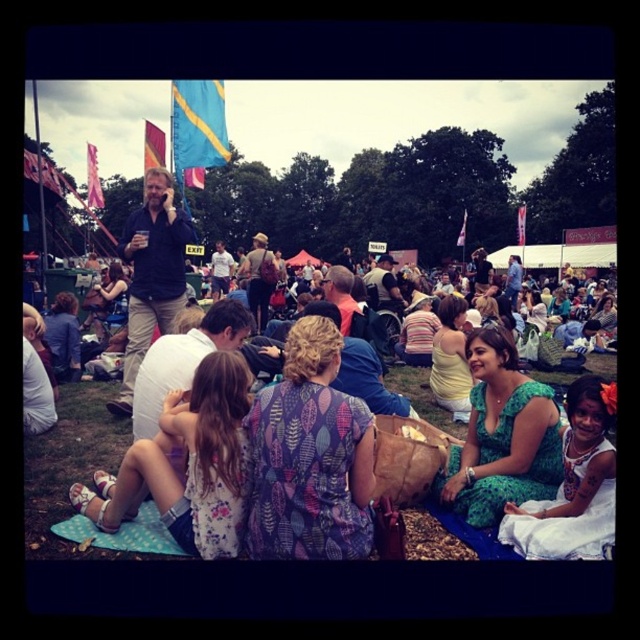
You are a GUI agent. You are given a task and a screenshot of the screen. Output one action in this format:
    pyautogui.click(x=<x>, y=<y>)
    Task: Click on the dark blue shirt at center
    
    Given the screenshot: What is the action you would take?
    pyautogui.click(x=150, y=275)

Can you confirm if dark blue shirt at center is positioned above matte brown backpack at center?

Correct, dark blue shirt at center is located above matte brown backpack at center.

Which is in front, point (134, 282) or point (333, 301)?

Positioned in front is point (134, 282).

You are a GUI agent. You are given a task and a screenshot of the screen. Output one action in this format:
    pyautogui.click(x=<x>, y=<y>)
    Task: Click on the dark blue shirt at center
    
    Given the screenshot: What is the action you would take?
    pyautogui.click(x=150, y=275)

Is printed fabric blanket at center below blue fabric flag at upper center?

Yes, printed fabric blanket at center is below blue fabric flag at upper center.

Is printed fabric blanket at center shorter than blue fabric flag at upper center?

Yes.

Where is `printed fabric blanket at center`? Image resolution: width=640 pixels, height=640 pixels. printed fabric blanket at center is located at coordinates (70, 468).

Locate an element on the screen. printed fabric blanket at center is located at coordinates (70, 468).

Is point (170, 218) farther from viewer compared to point (209, 132)?

No, (170, 218) is closer to viewer.

Who is lower down, dark blue shirt at center or blue fabric flag at upper center?

dark blue shirt at center

This screenshot has height=640, width=640. What are the coordinates of `dark blue shirt at center` in the screenshot? It's located at (150, 275).